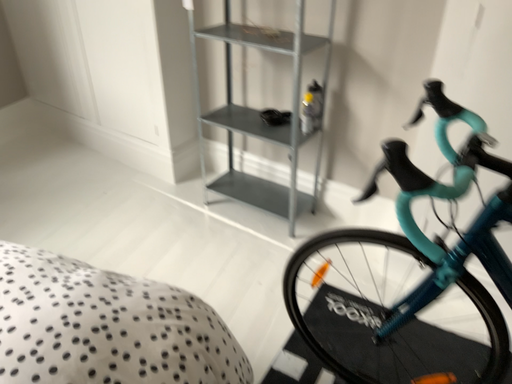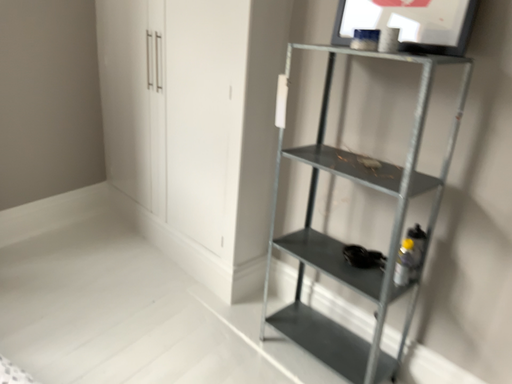
Question: How did the camera likely rotate when shooting the video?

Choices:
 (A) rotated right
 (B) rotated left

Answer: (B)